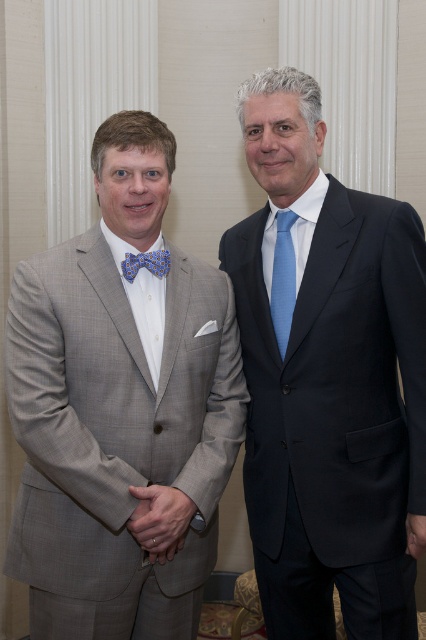
Is point (206, 424) behind point (149, 259)?

Yes, it is.

Which is in front, point (69, 435) or point (149, 260)?

Point (69, 435) is in front.

Locate an element on the screen. Image resolution: width=426 pixels, height=640 pixels. light gray textured suit at left is located at coordinates (x=120, y=410).

Looking at this image, is light blue textured tie at center below blue printed fabric bow tie at left?

Indeed, light blue textured tie at center is positioned under blue printed fabric bow tie at left.

Measure the distance between point (270, 308) and camera.

A distance of 5.50 feet exists between point (270, 308) and camera.

Locate an element on the screen. Image resolution: width=426 pixels, height=640 pixels. light blue textured tie at center is located at coordinates (282, 280).

Consider the image. Does satin black suit at right have a greater height compared to blue printed fabric bow tie at left?

Yes.

Who is positioned more to the right, satin black suit at right or blue printed fabric bow tie at left?

Positioned to the right is satin black suit at right.

You are a GUI agent. You are given a task and a screenshot of the screen. Output one action in this format:
    pyautogui.click(x=<x>, y=<y>)
    Task: Click on the satin black suit at right
    The width and height of the screenshot is (426, 640).
    Given the screenshot: What is the action you would take?
    pyautogui.click(x=328, y=381)